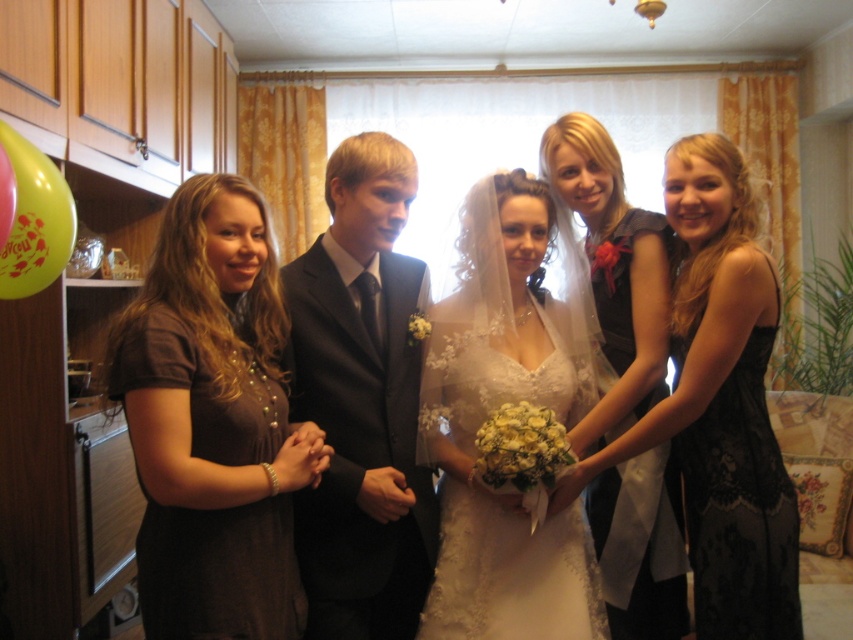
Who is lower down, brown matte dress at left or white lace dress at center?

white lace dress at center

Looking at this image, who is more forward, (149, 508) or (485, 189)?

Point (149, 508) is more forward.

The width and height of the screenshot is (853, 640). What are the coordinates of `brown matte dress at left` in the screenshot? It's located at (213, 422).

Image resolution: width=853 pixels, height=640 pixels. Identify the location of white lace dress at center. (497, 406).

Can you confirm if white lace dress at center is wider than matte black dress at right?

Indeed, white lace dress at center has a greater width compared to matte black dress at right.

At what (x,y) coordinates should I click in order to perform the action: click on white lace dress at center. Please return your answer as a coordinate pair (x, y). The image size is (853, 640). Looking at the image, I should click on point(497,406).

Is brown matte dress at left positioned before matte black dress at right?

Yes, brown matte dress at left is closer to the viewer.

Based on the photo, who is positioned more to the left, brown matte dress at left or matte black dress at right?

brown matte dress at left

The width and height of the screenshot is (853, 640). What do you see at coordinates (213, 422) in the screenshot? I see `brown matte dress at left` at bounding box center [213, 422].

The image size is (853, 640). I want to click on brown matte dress at left, so click(x=213, y=422).